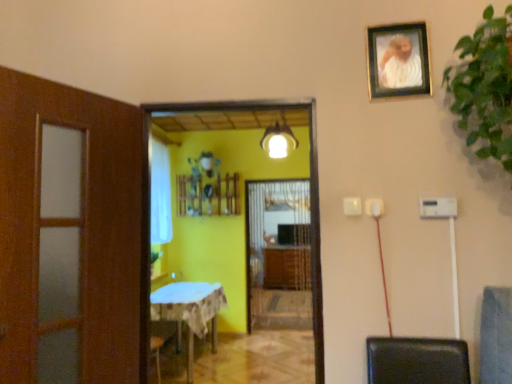
Question: Should I look upward or downward to see white glossy light fixture at center?

Choices:
 (A) up
 (B) down

Answer: (A)

Question: Is yellow matte screen door at center, positioned as the first screen door in front-to-back order, wider than gold-framed photo at upper right?

Choices:
 (A) yes
 (B) no

Answer: (A)

Question: Is yellow matte screen door at center, positioned as the first screen door in front-to-back order, to the right of gold-framed photo at upper right from the viewer's perspective?

Choices:
 (A) yes
 (B) no

Answer: (B)

Question: Is yellow matte screen door at center, positioned as the first screen door in front-to-back order, shorter than gold-framed photo at upper right?

Choices:
 (A) no
 (B) yes

Answer: (A)

Question: Is yellow matte screen door at center, which appears as the 2th screen door when viewed from the back, turned away from gold-framed photo at upper right?

Choices:
 (A) no
 (B) yes

Answer: (A)

Question: From the image's perspective, is yellow matte screen door at center, positioned as the first screen door in front-to-back order, under gold-framed photo at upper right?

Choices:
 (A) yes
 (B) no

Answer: (A)

Question: Does yellow matte screen door at center, which appears as the 2th screen door when viewed from the back, come behind gold-framed photo at upper right?

Choices:
 (A) yes
 (B) no

Answer: (A)

Question: Is wooden cabinet at center positioned in front of white glossy light fixture at center?

Choices:
 (A) yes
 (B) no

Answer: (B)

Question: Is wooden cabinet at center to the right of white glossy light fixture at center from the viewer's perspective?

Choices:
 (A) yes
 (B) no

Answer: (A)

Question: Is wooden cabinet at center bigger than white glossy light fixture at center?

Choices:
 (A) yes
 (B) no

Answer: (A)

Question: Is wooden cabinet at center further to camera compared to white glossy light fixture at center?

Choices:
 (A) yes
 (B) no

Answer: (A)

Question: Considering the relative sizes of wooden cabinet at center and white glossy light fixture at center in the image provided, is wooden cabinet at center taller than white glossy light fixture at center?

Choices:
 (A) no
 (B) yes

Answer: (B)

Question: Is wooden cabinet at center at the left side of white glossy light fixture at center?

Choices:
 (A) no
 (B) yes

Answer: (A)

Question: Is green leafy plant at upper right taller than white sheer curtain at left?

Choices:
 (A) yes
 (B) no

Answer: (B)